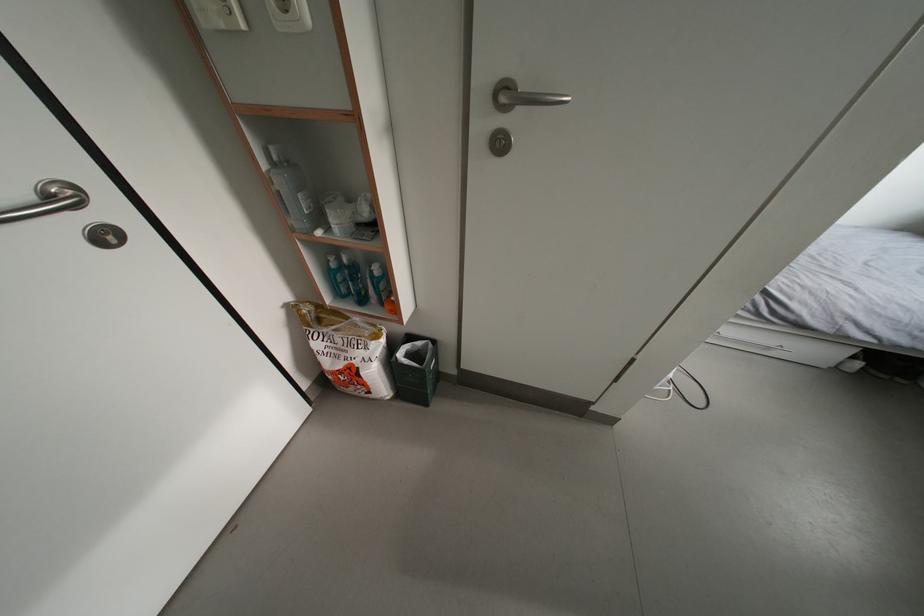
Find where to lift the large clear bottle. Please return your answer as a coordinate pair (x, y).

(293, 191)